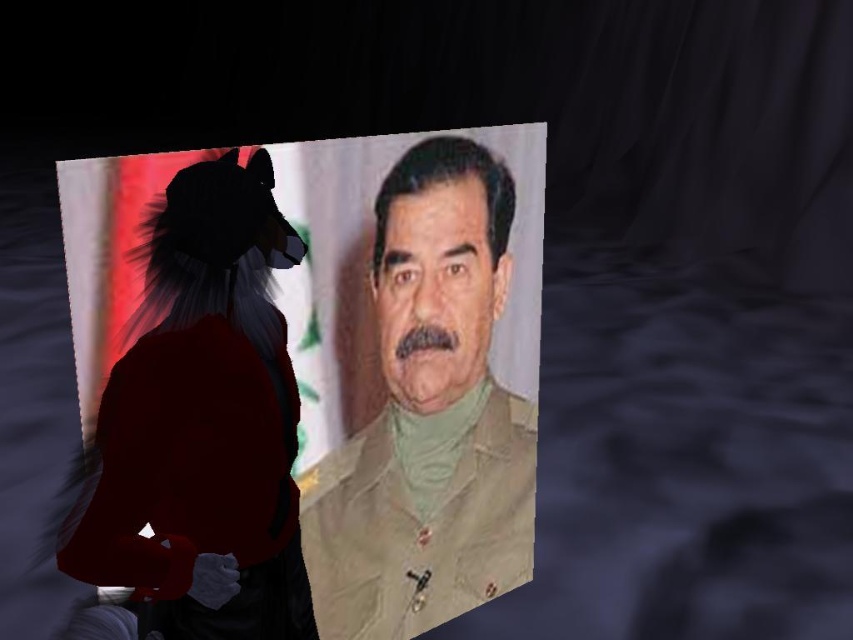
Based on the scene description, which object is taller between the beige uniform at center and the beige matte face at center?

The beige uniform at center is taller than the beige matte face at center.

Based on the provided scene description, which object is positioned to the left when comparing the beige matte uniform at center and the beige matte face at center?

The beige matte uniform at center is positioned to the left of the beige matte face at center according to the description.